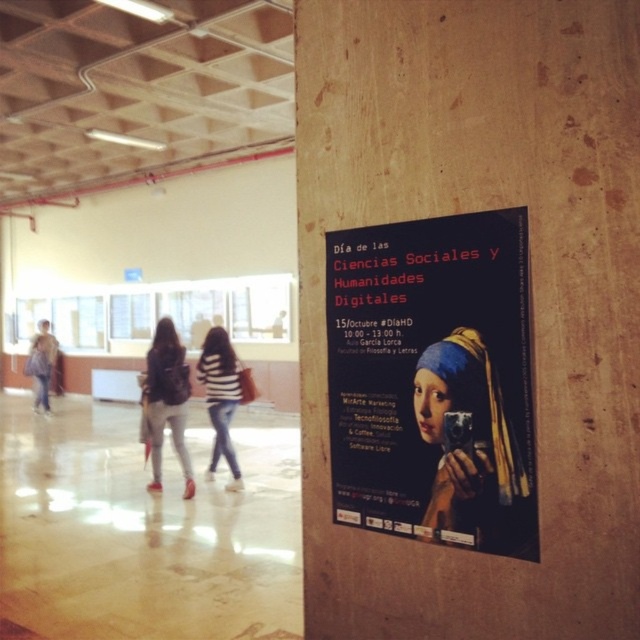
Who is more forward, (180, 442) or (234, 467)?

Point (180, 442) is in front.

Can you confirm if light brown fabric pants at center is thinner than striped fabric sweater at center?

Incorrect, light brown fabric pants at center's width is not less than striped fabric sweater at center's.

The height and width of the screenshot is (640, 640). I want to click on light brown fabric pants at center, so click(x=166, y=401).

Does black matte poster at center have a lesser height compared to light brown fabric pants at center?

Yes.

Between point (516, 298) and point (157, 444), which one is positioned in front?

Point (516, 298) is in front.

I want to click on black matte poster at center, so pyautogui.click(x=433, y=380).

Does black matte poster at center have a lesser height compared to striped fabric sweater at center?

Indeed, black matte poster at center has a lesser height compared to striped fabric sweater at center.

Which is more to the right, black matte poster at center or striped fabric sweater at center?

black matte poster at center is more to the right.

Is point (499, 296) closer to camera compared to point (205, 340)?

That is True.

Where is `black matte poster at center`? This screenshot has width=640, height=640. black matte poster at center is located at coordinates (433, 380).